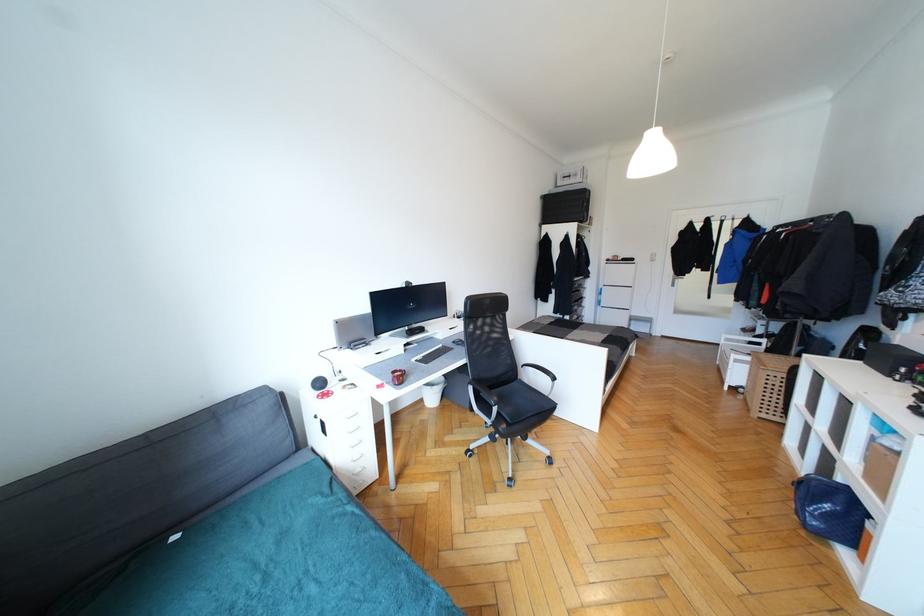
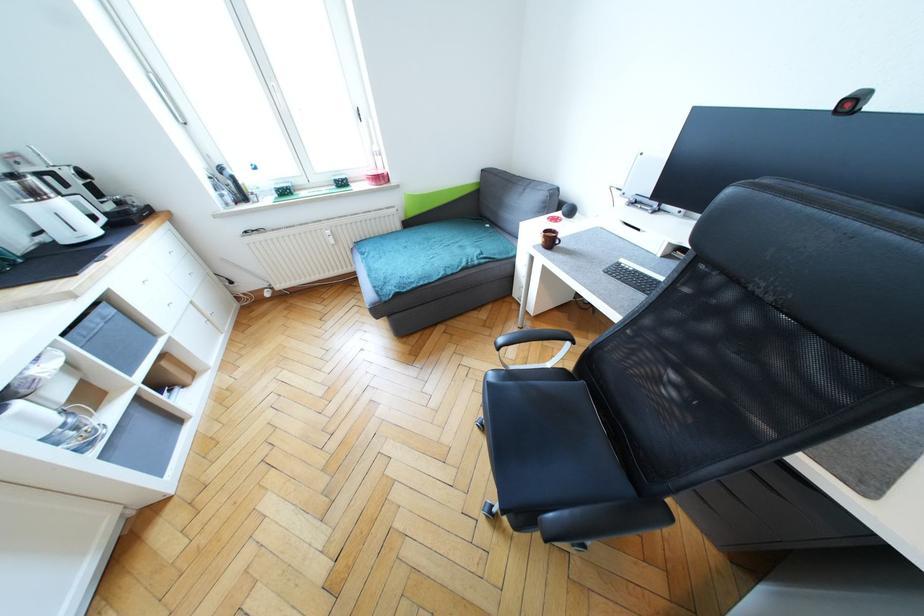
In the second image, find the point that corresponds to the point at 353,509 in the first image.

(467, 265)